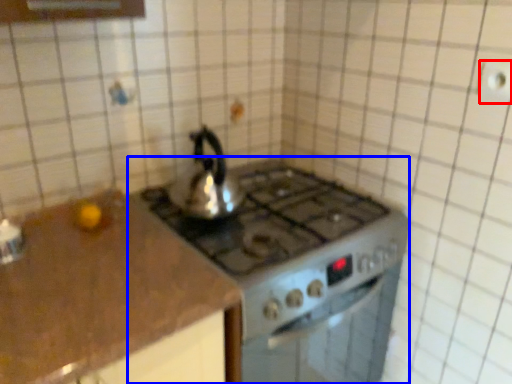
Question: Which object is closer to the camera taking this photo, electric outlet (highlighted by a red box) or gas stove (highlighted by a blue box)?

Choices:
 (A) electric outlet
 (B) gas stove

Answer: (A)